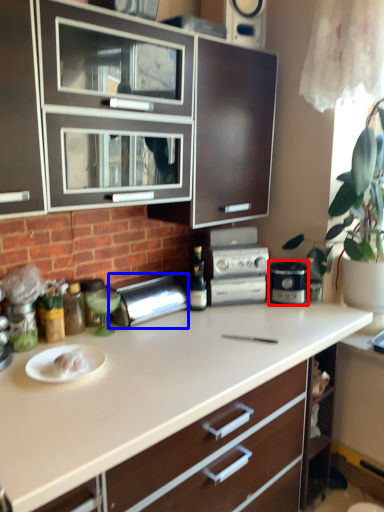
Question: Which object is further to the camera taking this photo, home appliance (highlighted by a red box) or appliance (highlighted by a blue box)?

Choices:
 (A) home appliance
 (B) appliance

Answer: (A)